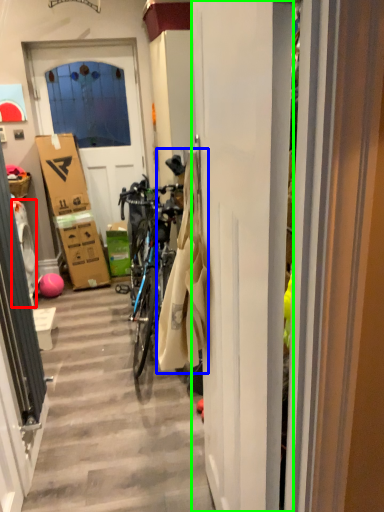
Question: Based on their relative distances, which object is farther from washing machine (highlighted by a red box)? Choose from laundry (highlighted by a blue box) and door (highlighted by a green box).

Choices:
 (A) laundry
 (B) door

Answer: (B)